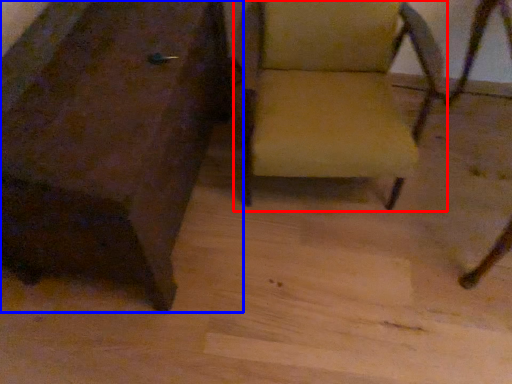
Question: Which object appears closest to the camera in this image, chair (highlighted by a red box) or chair (highlighted by a blue box)?

Choices:
 (A) chair
 (B) chair

Answer: (B)